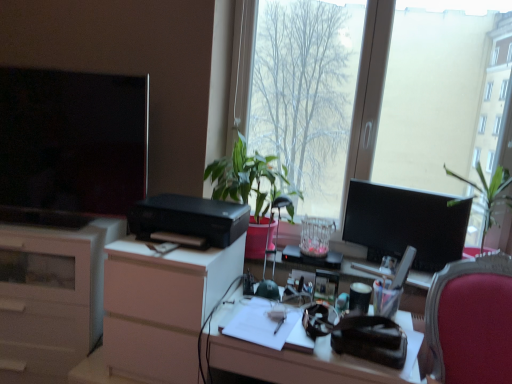
Question: Is white paper at center positioned far away from matte black television at left, which is the 2th television from right to left?

Choices:
 (A) no
 (B) yes

Answer: (A)

Question: Does white paper at center have a greater height compared to matte black television at left, which is the 2th television from right to left?

Choices:
 (A) yes
 (B) no

Answer: (B)

Question: Is white paper at center surrounding matte black television at left, which is the 2th television from right to left?

Choices:
 (A) yes
 (B) no

Answer: (B)

Question: Can you confirm if white paper at center is thinner than matte black television at left, acting as the 1th television starting from the left?

Choices:
 (A) yes
 (B) no

Answer: (B)

Question: Is white paper at center touching matte black television at left, which is the 2th television from right to left?

Choices:
 (A) yes
 (B) no

Answer: (B)

Question: From their relative heights in the image, would you say velvet red chair at right is taller or shorter than matte black desk at center?

Choices:
 (A) short
 (B) tall

Answer: (B)

Question: Which is correct: velvet red chair at right is inside matte black desk at center, or outside of it?

Choices:
 (A) inside
 (B) outside

Answer: (B)

Question: Is point pyautogui.click(x=476, y=324) positioned closer to the camera than point pyautogui.click(x=217, y=339)?

Choices:
 (A) farther
 (B) closer

Answer: (A)

Question: In terms of size, does velvet red chair at right appear bigger or smaller than matte black desk at center?

Choices:
 (A) big
 (B) small

Answer: (A)

Question: From the image's perspective, relative to white matte dresser at center, is white paper at center above or below?

Choices:
 (A) below
 (B) above

Answer: (A)

Question: Is white paper at center in front of or behind white matte dresser at center in the image?

Choices:
 (A) front
 (B) behind

Answer: (A)

Question: In terms of size, does white paper at center appear bigger or smaller than white matte dresser at center?

Choices:
 (A) small
 (B) big

Answer: (A)

Question: Considering the positions of white paper at center and white matte dresser at center in the image, is white paper at center wider or thinner than white matte dresser at center?

Choices:
 (A) thin
 (B) wide

Answer: (A)

Question: Considering the positions of matte black desk at center and green leafy plant at center in the image, is matte black desk at center bigger or smaller than green leafy plant at center?

Choices:
 (A) small
 (B) big

Answer: (B)

Question: From the image's perspective, relative to green leafy plant at center, is matte black desk at center above or below?

Choices:
 (A) above
 (B) below

Answer: (B)